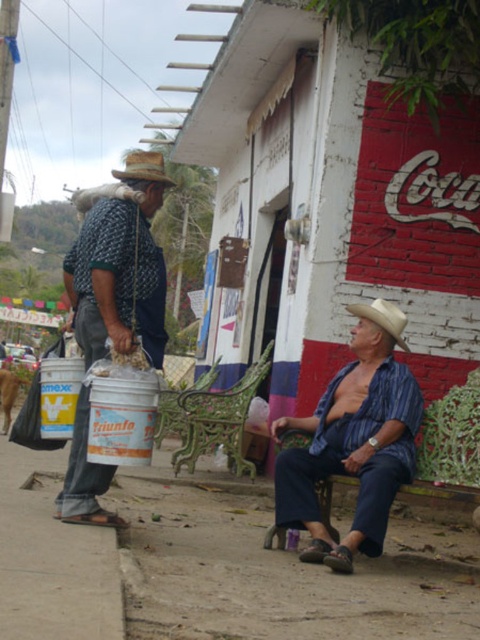
Question: Which of the following is the farthest from the observer?

Choices:
 (A) (355, 376)
 (B) (74, 320)
 (C) (394, 330)
 (D) (400, 410)

Answer: (A)

Question: Is matte black bucket at left further to camera compared to rustic straw cowboy hat at left?

Choices:
 (A) yes
 (B) no

Answer: (B)

Question: Can you confirm if brown dirt at lower left is positioned above rustic straw cowboy hat at left?

Choices:
 (A) no
 (B) yes

Answer: (A)

Question: Can you confirm if brown dirt at lower left is positioned to the right of rustic straw cowboy hat at left?

Choices:
 (A) yes
 (B) no

Answer: (A)

Question: Based on their relative distances, which object is nearer to the blue striped shirt at center?

Choices:
 (A) matte black bucket at left
 (B) beige straw hat at lower right
 (C) brown dirt at lower left

Answer: (B)

Question: Which of these objects is positioned farthest from the blue striped shirt at center?

Choices:
 (A) matte white bucket at left
 (B) beige straw hat at lower right

Answer: (B)